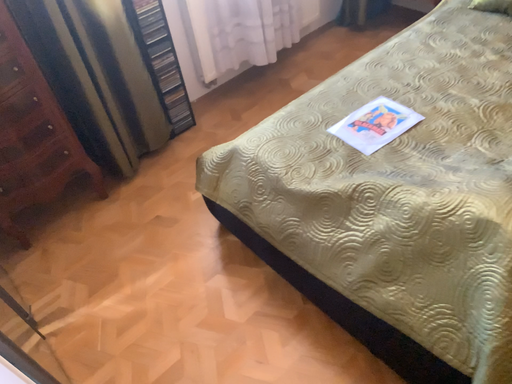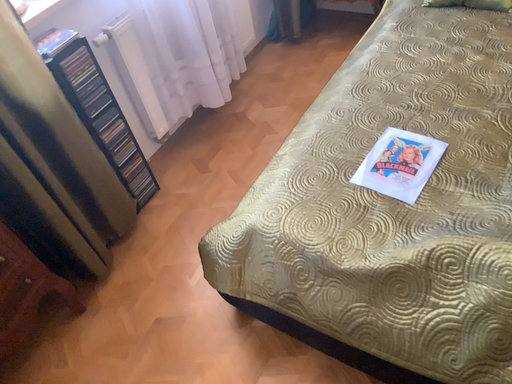
Question: How did the camera likely rotate when shooting the video?

Choices:
 (A) rotated left
 (B) rotated right

Answer: (B)